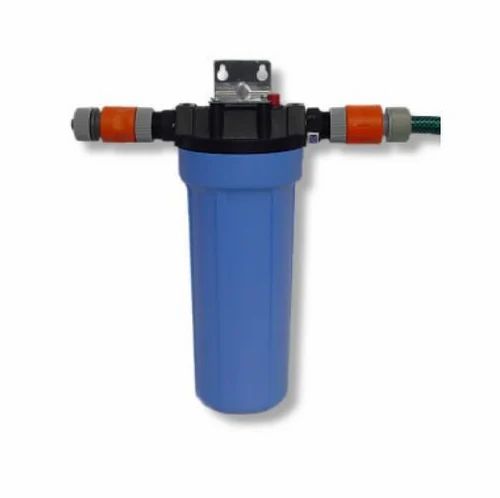
Identify the location of blue bin. The height and width of the screenshot is (498, 500). (252, 312).